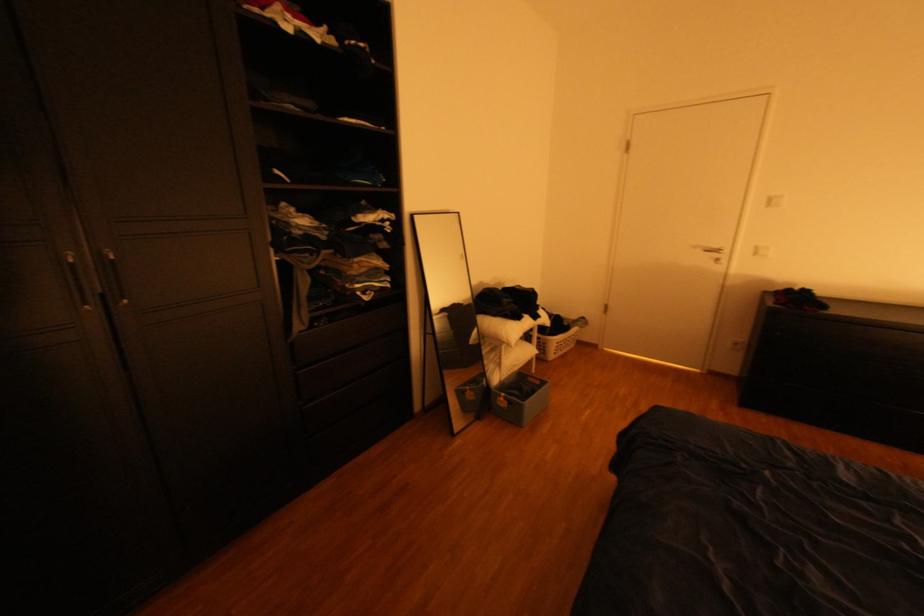
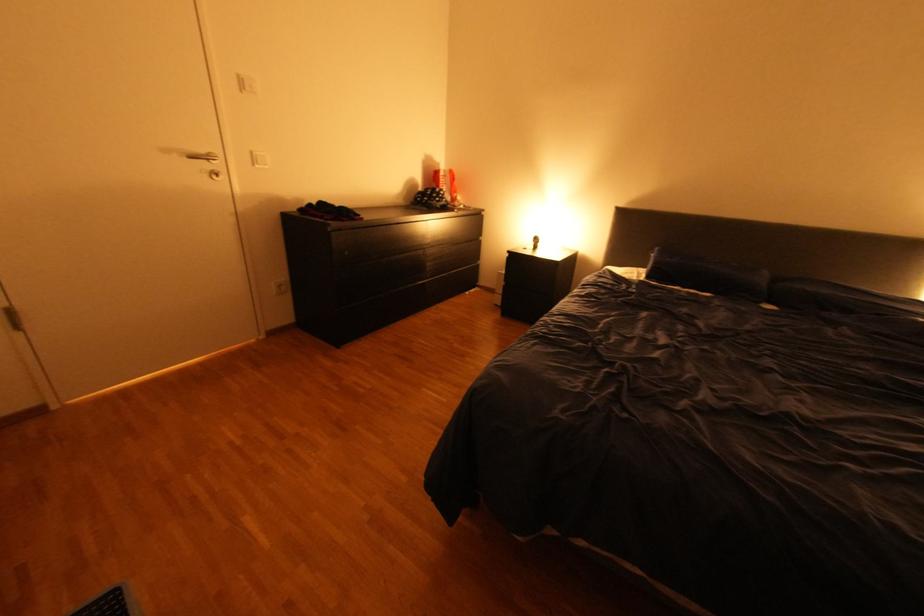
Locate, in the second image, the point that corresponds to pixel 774 207 in the first image.

(251, 91)